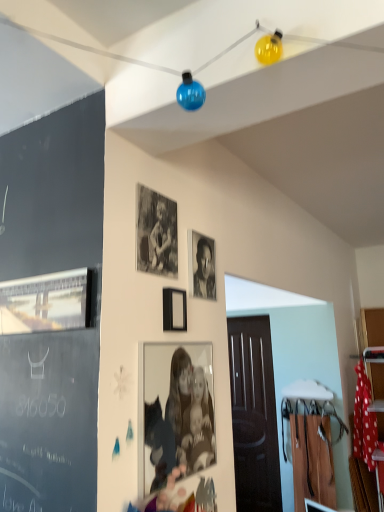
Question: Could you tell me if metallic silver picture frame at left, which is the 2th picture frame in top-to-bottom order, is facing black and white photograph at center?

Choices:
 (A) no
 (B) yes

Answer: (A)

Question: From the image's perspective, is metallic silver picture frame at left, which is the first picture frame in left-to-right order, under black and white photograph at center?

Choices:
 (A) yes
 (B) no

Answer: (A)

Question: Is metallic silver picture frame at left, which is the 2th picture frame in top-to-bottom order, with black and white photograph at center?

Choices:
 (A) no
 (B) yes

Answer: (A)

Question: From a real-world perspective, is metallic silver picture frame at left, which is the first picture frame in left-to-right order, positioned under black and white photograph at center based on gravity?

Choices:
 (A) yes
 (B) no

Answer: (A)

Question: Considering the relative sizes of metallic silver picture frame at left, which is the first picture frame in left-to-right order, and black and white photograph at center in the image provided, is metallic silver picture frame at left, which is the first picture frame in left-to-right order, wider than black and white photograph at center?

Choices:
 (A) no
 (B) yes

Answer: (A)

Question: Considering their positions, is black and white photograph at center located in front of or behind black matte picture frame at center, positioned as the 3th picture frame in top-to-bottom order?

Choices:
 (A) front
 (B) behind

Answer: (B)

Question: Looking at their shapes, would you say black and white photograph at center is wider or thinner than black matte picture frame at center, which is the 3th picture frame in left-to-right order?

Choices:
 (A) thin
 (B) wide

Answer: (A)

Question: Considering the relative positions of black and white photograph at center and black matte picture frame at center, which is the 3th picture frame in left-to-right order, in the image provided, is black and white photograph at center to the left or to the right of black matte picture frame at center, which is the 3th picture frame in left-to-right order,?

Choices:
 (A) left
 (B) right

Answer: (B)

Question: Would you say black and white photograph at center is inside or outside black matte picture frame at center, which ranks as the second picture frame in right-to-left order?

Choices:
 (A) inside
 (B) outside

Answer: (B)

Question: Is black and white photograph at center taller or shorter than metallic silver picture frame at left, acting as the 3th picture frame starting from the bottom?

Choices:
 (A) tall
 (B) short

Answer: (A)

Question: Considering the positions of black and white photograph at center and metallic silver picture frame at left, which is the 2th picture frame in top-to-bottom order, in the image, is black and white photograph at center wider or thinner than metallic silver picture frame at left, which is the 2th picture frame in top-to-bottom order,?

Choices:
 (A) wide
 (B) thin

Answer: (A)

Question: Based on their sizes in the image, would you say black and white photograph at center is bigger or smaller than metallic silver picture frame at left, which appears as the fourth picture frame when viewed from the right?

Choices:
 (A) small
 (B) big

Answer: (A)

Question: From the image's perspective, relative to metallic silver picture frame at left, which is the 2th picture frame in top-to-bottom order, is black and white photograph at center above or below?

Choices:
 (A) above
 (B) below

Answer: (A)

Question: From the image's perspective, is black and white photograph at center positioned above or below matte black photo frame at center, which appears as the fourth picture frame when viewed from the left?

Choices:
 (A) above
 (B) below

Answer: (A)

Question: Looking at their shapes, would you say black and white photograph at center is wider or thinner than matte black photo frame at center, which appears as the fourth picture frame when viewed from the left?

Choices:
 (A) wide
 (B) thin

Answer: (A)